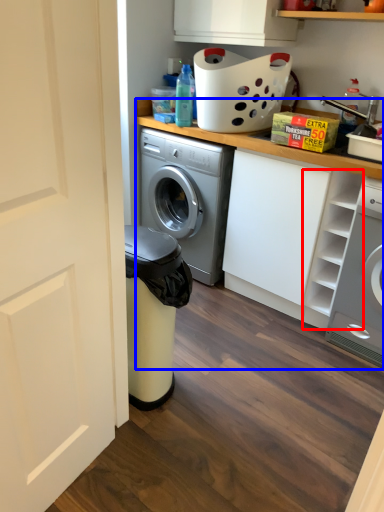
Question: Which object appears farthest to the camera in this image, shelf (highlighted by a red box) or counter top (highlighted by a blue box)?

Choices:
 (A) shelf
 (B) counter top

Answer: (B)